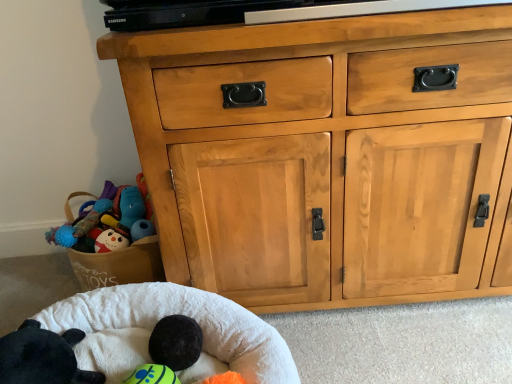
Question: Is natural wood cabinet at center aimed at black plush toy at lower left?

Choices:
 (A) no
 (B) yes

Answer: (A)

Question: Considering the relative positions of natural wood cabinet at center and black plush toy at lower left in the image provided, is natural wood cabinet at center to the left of black plush toy at lower left from the viewer's perspective?

Choices:
 (A) no
 (B) yes

Answer: (A)

Question: Does natural wood cabinet at center appear on the right side of black plush toy at lower left?

Choices:
 (A) no
 (B) yes

Answer: (B)

Question: From the image's perspective, is natural wood cabinet at center located beneath black plush toy at lower left?

Choices:
 (A) no
 (B) yes

Answer: (A)

Question: Can you confirm if natural wood cabinet at center is wider than black plush toy at lower left?

Choices:
 (A) no
 (B) yes

Answer: (B)

Question: Can you confirm if natural wood cabinet at center is bigger than black plush toy at lower left?

Choices:
 (A) no
 (B) yes

Answer: (B)

Question: Is white soft infant bed at lower left wider than natural wood cabinet at center?

Choices:
 (A) no
 (B) yes

Answer: (B)

Question: Is white soft infant bed at lower left shorter than natural wood cabinet at center?

Choices:
 (A) no
 (B) yes

Answer: (B)

Question: Is white soft infant bed at lower left in contact with natural wood cabinet at center?

Choices:
 (A) no
 (B) yes

Answer: (A)

Question: Does white soft infant bed at lower left have a larger size compared to natural wood cabinet at center?

Choices:
 (A) no
 (B) yes

Answer: (A)

Question: From the image's perspective, is white soft infant bed at lower left located beneath natural wood cabinet at center?

Choices:
 (A) yes
 (B) no

Answer: (A)

Question: Is natural wood cabinet at center surrounded by white soft infant bed at lower left?

Choices:
 (A) yes
 (B) no

Answer: (B)

Question: Does white soft infant bed at lower left come behind black plush toy at lower left?

Choices:
 (A) yes
 (B) no

Answer: (B)